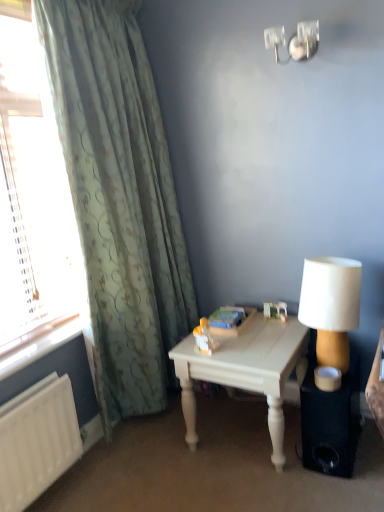
Question: Looking at their shapes, would you say white painted wood table at center is wider or thinner than clear glass window at left?

Choices:
 (A) thin
 (B) wide

Answer: (B)

Question: Considering the positions of white painted wood table at center and clear glass window at left in the image, is white painted wood table at center taller or shorter than clear glass window at left?

Choices:
 (A) tall
 (B) short

Answer: (B)

Question: Estimate the real-world distances between objects in this image. Which object is farther from the metallic wall sconce at upper right?

Choices:
 (A) green textured curtain at left
 (B) black matte speaker at lower right
 (C) white fabric lampshade at right
 (D) clear glass window at left
 (E) white painted wood table at center

Answer: (B)

Question: Considering the real-world distances, which object is farthest from the green textured curtain at left?

Choices:
 (A) black matte speaker at lower right
 (B) metallic wall sconce at upper right
 (C) clear glass window at left
 (D) white fabric lampshade at right
 (E) white painted wood table at center

Answer: (A)